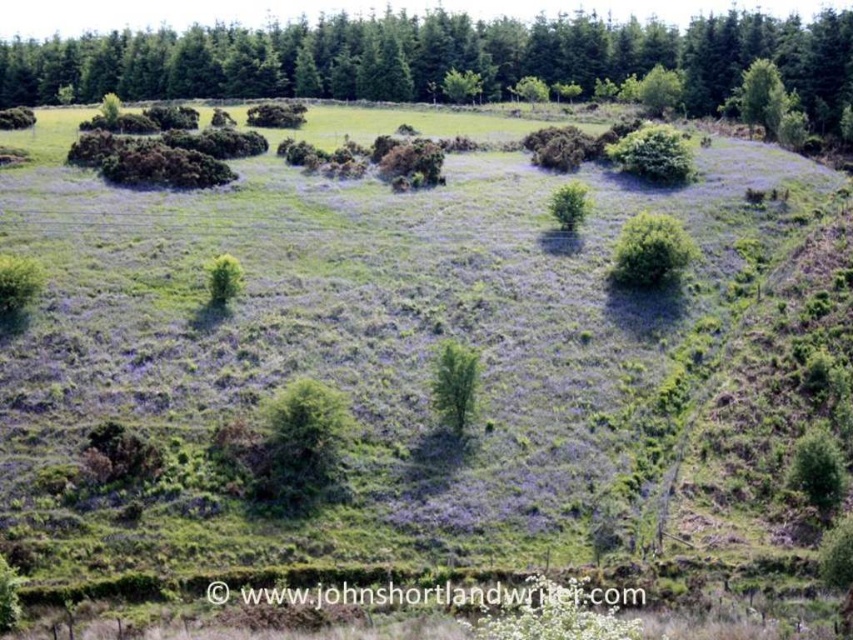
Can you confirm if green leafy tree at upper center is positioned to the right of green leafy bush at center?

Incorrect, green leafy tree at upper center is not on the right side of green leafy bush at center.

Does green leafy tree at upper center have a greater width compared to green leafy bush at center?

Yes, green leafy tree at upper center is wider than green leafy bush at center.

Is point (123, 81) positioned before point (643, 220)?

No.

Where is `green leafy tree at upper center`? The image size is (853, 640). green leafy tree at upper center is located at coordinates (438, 58).

Locate an element on the screen. Image resolution: width=853 pixels, height=640 pixels. green leafy tree at upper center is located at coordinates (438, 58).

The height and width of the screenshot is (640, 853). Find the location of `green leafy tree at upper center`. green leafy tree at upper center is located at coordinates (438, 58).

How much distance is there between green leafy bush at center and green leafy tree at center?

green leafy bush at center is 19.98 meters from green leafy tree at center.

Who is positioned more to the right, green leafy bush at center or green leafy tree at center?

green leafy bush at center

The image size is (853, 640). I want to click on green leafy bush at center, so (x=650, y=250).